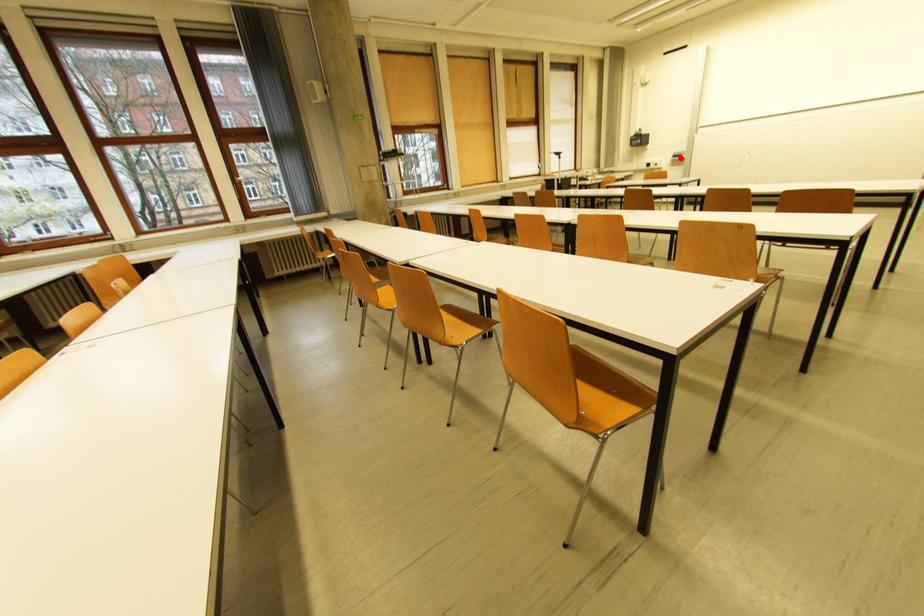
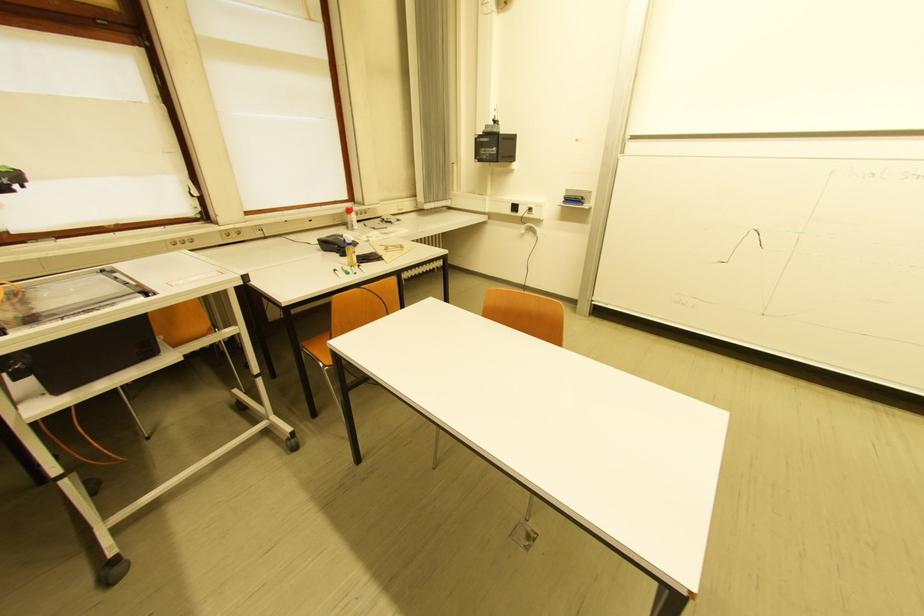
In the second image, find the point that corresponds to the highlighted location in the first image.

(575, 201)